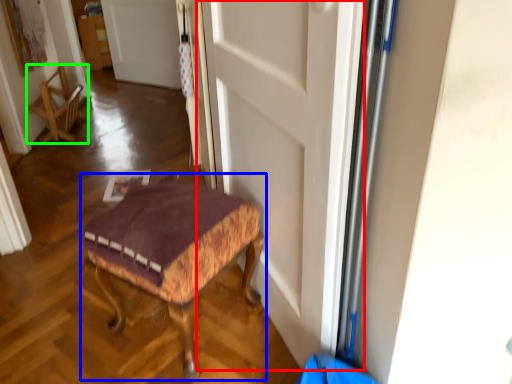
Question: Estimate the real-world distances between objects in this image. Which object is farther from door (highlighted by a red box), furniture (highlighted by a blue box) or chair (highlighted by a green box)?

Choices:
 (A) furniture
 (B) chair

Answer: (B)